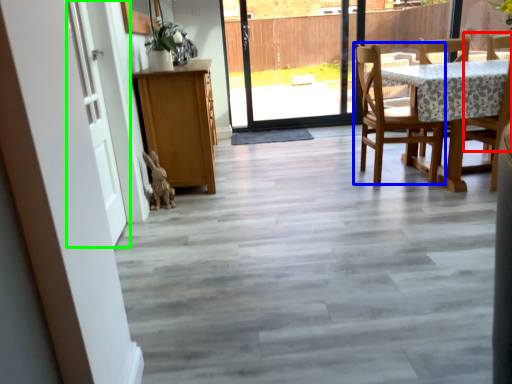
Question: Considering the real-world distances, which object is farthest from chair (highlighted by a red box)? chair (highlighted by a blue box) or door (highlighted by a green box)?

Choices:
 (A) chair
 (B) door

Answer: (B)